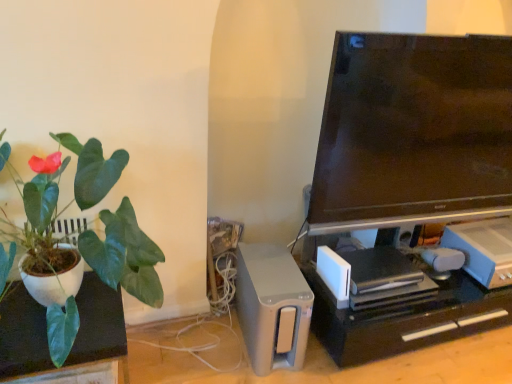
What do you see at coordinates (55, 199) in the screenshot? I see `matte white pot at left` at bounding box center [55, 199].

Describe the element at coordinates (22, 335) in the screenshot. I see `white matte plant pot at left` at that location.

What do you see at coordinates (413, 132) in the screenshot? The image size is (512, 384). I see `matte black tv at upper right` at bounding box center [413, 132].

Looking at this image, measure the distance between matte black tv at upper right and camera.

The depth of matte black tv at upper right is 4.94 feet.

In order to click on white plastic game console at lower right, the 1th appliance positioned from the right in this screenshot , I will do `click(483, 249)`.

Can you confirm if white plastic game console at lower right, the 1th appliance positioned from the right, is positioned to the left of matte white pot at left?

No, white plastic game console at lower right, the 1th appliance positioned from the right, is not to the left of matte white pot at left.

Between point (485, 262) and point (1, 134), which one is positioned in front?

The point (1, 134) is closer.

Does white plastic game console at lower right, the 1th appliance positioned from the right, have a larger size compared to matte white pot at left?

Incorrect, white plastic game console at lower right, the 1th appliance positioned from the right, is not larger than matte white pot at left.

Which object is further away from the camera taking this photo, white plastic game console at lower right, the 1th appliance positioned from the right, or matte white pot at left?

white plastic game console at lower right, the 1th appliance positioned from the right, is more distant.

Image resolution: width=512 pixels, height=384 pixels. In order to click on houseplant that is above the satin silver speaker at lower center, the first appliance viewed from the left (from the image's perspective) in this screenshot , I will do `click(55, 199)`.

Can you tell me how much satin silver speaker at lower center, the first appliance viewed from the left, and matte white pot at left differ in facing direction?

5.43 degrees separate the facing orientations of satin silver speaker at lower center, the first appliance viewed from the left, and matte white pot at left.

Would you say satin silver speaker at lower center, the first appliance viewed from the left, is outside matte white pot at left?

Yes, satin silver speaker at lower center, the first appliance viewed from the left, is not within matte white pot at left.

Considering the relative sizes of satin silver speaker at lower center, the second appliance in the right-to-left sequence, and matte black tv at upper right in the image provided, is satin silver speaker at lower center, the second appliance in the right-to-left sequence, bigger than matte black tv at upper right?

Actually, satin silver speaker at lower center, the second appliance in the right-to-left sequence, might be smaller than matte black tv at upper right.

Is satin silver speaker at lower center, the first appliance viewed from the left, oriented away from matte black tv at upper right?

No, satin silver speaker at lower center, the first appliance viewed from the left, is not facing away from matte black tv at upper right.

Is satin silver speaker at lower center, the first appliance viewed from the left, outside of matte black tv at upper right?

Yes, satin silver speaker at lower center, the first appliance viewed from the left, is outside of matte black tv at upper right.

In the image, is white matte plant pot at left positioned in front of or behind white plastic game console at lower right, which is the second appliance in left-to-right order?

In the image, white matte plant pot at left appears in front of white plastic game console at lower right, which is the second appliance in left-to-right order.

Is point (114, 340) positioned in front of point (471, 246)?

Yes, point (114, 340) is closer to viewer.

Consider the image. Is there a large distance between white matte plant pot at left and white plastic game console at lower right, which is the second appliance in left-to-right order?

Yes, white matte plant pot at left and white plastic game console at lower right, which is the second appliance in left-to-right order, are quite far apart.

Considering the relative sizes of matte white pot at left and white matte plant pot at left in the image provided, is matte white pot at left taller than white matte plant pot at left?

Yes.

Which is farther, [152,282] or [32,301]?

The point [152,282] is behind.

Looking at this image, could you tell me if matte white pot at left is facing white matte plant pot at left?

No.

Considering the relative positions of white matte plant pot at left and satin silver speaker at lower center, the first appliance viewed from the left, in the image provided, is white matte plant pot at left to the left or to the right of satin silver speaker at lower center, the first appliance viewed from the left,?

Based on their positions, white matte plant pot at left is located to the left of satin silver speaker at lower center, the first appliance viewed from the left.

Would you say satin silver speaker at lower center, the second appliance in the right-to-left sequence, is part of white matte plant pot at left's contents?

Actually, satin silver speaker at lower center, the second appliance in the right-to-left sequence, is outside white matte plant pot at left.

What's the angular difference between white matte plant pot at left and satin silver speaker at lower center, the first appliance viewed from the left,'s facing directions?

They differ by 5.43 degrees in their facing directions.

Is white plastic game console at lower right, the 1th appliance positioned from the right, positioned far away from satin silver speaker at lower center, the first appliance viewed from the left?

No, white plastic game console at lower right, the 1th appliance positioned from the right, is not far from satin silver speaker at lower center, the first appliance viewed from the left.

Considering the relative sizes of white plastic game console at lower right, the 1th appliance positioned from the right, and satin silver speaker at lower center, the second appliance in the right-to-left sequence, in the image provided, is white plastic game console at lower right, the 1th appliance positioned from the right, wider than satin silver speaker at lower center, the second appliance in the right-to-left sequence,?

No, white plastic game console at lower right, the 1th appliance positioned from the right, is not wider than satin silver speaker at lower center, the second appliance in the right-to-left sequence.

Considering the relative sizes of white plastic game console at lower right, the 1th appliance positioned from the right, and satin silver speaker at lower center, the second appliance in the right-to-left sequence, in the image provided, is white plastic game console at lower right, the 1th appliance positioned from the right, taller than satin silver speaker at lower center, the second appliance in the right-to-left sequence,?

No, white plastic game console at lower right, the 1th appliance positioned from the right, is not taller than satin silver speaker at lower center, the second appliance in the right-to-left sequence.

What are the coordinates of `the 1st appliance positioned below the matte white pot at left (from a real-world perspective)` in the screenshot? It's located at pyautogui.click(x=483, y=249).

Locate an element on the screen. houseplant above the satin silver speaker at lower center, the first appliance viewed from the left (from the image's perspective) is located at coordinates (55, 199).

Based on their spatial positions, is matte white pot at left or black plastic computer desk at lower right further from satin silver speaker at lower center, the first appliance viewed from the left?

The object further to satin silver speaker at lower center, the first appliance viewed from the left, is matte white pot at left.

Based on the photo, when comparing their distances from matte white pot at left, does black plastic computer desk at lower right or white matte plant pot at left seem further?

The object further to matte white pot at left is black plastic computer desk at lower right.

When comparing their distances from white plastic game console at lower right, which is the second appliance in left-to-right order, does white matte plant pot at left or satin silver speaker at lower center, the second appliance in the right-to-left sequence, seem further?

white matte plant pot at left lies further to white plastic game console at lower right, which is the second appliance in left-to-right order, than the other object.

Estimate the real-world distances between objects in this image. Which object is closer to white plastic game console at lower right, the 1th appliance positioned from the right, satin silver speaker at lower center, the second appliance in the right-to-left sequence, or white matte plant pot at left?

satin silver speaker at lower center, the second appliance in the right-to-left sequence, is positioned closer to the anchor white plastic game console at lower right, the 1th appliance positioned from the right.

When comparing their distances from white matte plant pot at left, does white plastic game console at lower right, the 1th appliance positioned from the right, or matte black tv at upper right seem closer?

matte black tv at upper right lies closer to white matte plant pot at left than the other object.

Based on their spatial positions, is white plastic game console at lower right, the 1th appliance positioned from the right, or matte black tv at upper right closer to black plastic computer desk at lower right?

Among the two, white plastic game console at lower right, the 1th appliance positioned from the right, is located nearer to black plastic computer desk at lower right.

From the image, which object appears to be farther from matte black tv at upper right, matte white pot at left or black plastic computer desk at lower right?

Based on the image, matte white pot at left appears to be further to matte black tv at upper right.

Which object lies further to the anchor point satin silver speaker at lower center, the second appliance in the right-to-left sequence, white plastic game console at lower right, the 1th appliance positioned from the right, or matte white pot at left?

white plastic game console at lower right, the 1th appliance positioned from the right, is positioned further to the anchor satin silver speaker at lower center, the second appliance in the right-to-left sequence.

At what (x,y) coordinates should I click in order to perform the action: click on appliance between white matte plant pot at left and matte black tv at upper right from left to right. Please return your answer as a coordinate pair (x, y). This screenshot has width=512, height=384. Looking at the image, I should click on (272, 307).

This screenshot has height=384, width=512. What are the coordinates of `houseplant between white matte plant pot at left and satin silver speaker at lower center, the second appliance in the right-to-left sequence, from left to right` in the screenshot? It's located at (55, 199).

At what (x,y) coordinates should I click in order to perform the action: click on houseplant located between white matte plant pot at left and white plastic game console at lower right, which is the second appliance in left-to-right order, in the left-right direction. Please return your answer as a coordinate pair (x, y). Looking at the image, I should click on (55, 199).

This screenshot has height=384, width=512. What are the coordinates of `computer desk between matte white pot at left and white plastic game console at lower right, the 1th appliance positioned from the right, in the horizontal direction` in the screenshot? It's located at (405, 317).